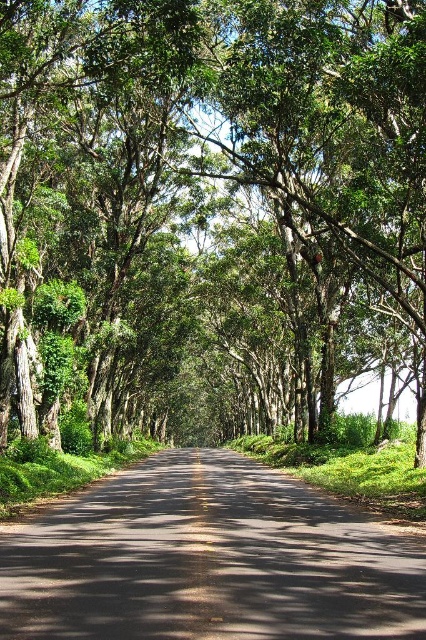
Question: Where is green leafy tree at center located in relation to black asphalt road at center in the image?

Choices:
 (A) left
 (B) right

Answer: (B)

Question: Which point is farther from the camera taking this photo?

Choices:
 (A) (166, 540)
 (B) (106, 172)

Answer: (B)

Question: Which point is farther from the camera taking this photo?

Choices:
 (A) (328, 276)
 (B) (146, 564)

Answer: (A)

Question: Does green leafy tree at center come in front of black asphalt road at center?

Choices:
 (A) no
 (B) yes

Answer: (A)

Question: Can you confirm if green leafy tree at center is positioned to the left of black asphalt road at center?

Choices:
 (A) yes
 (B) no

Answer: (B)

Question: Among these objects, which one is farthest from the camera?

Choices:
 (A) black asphalt road at center
 (B) green leafy tree at center

Answer: (B)